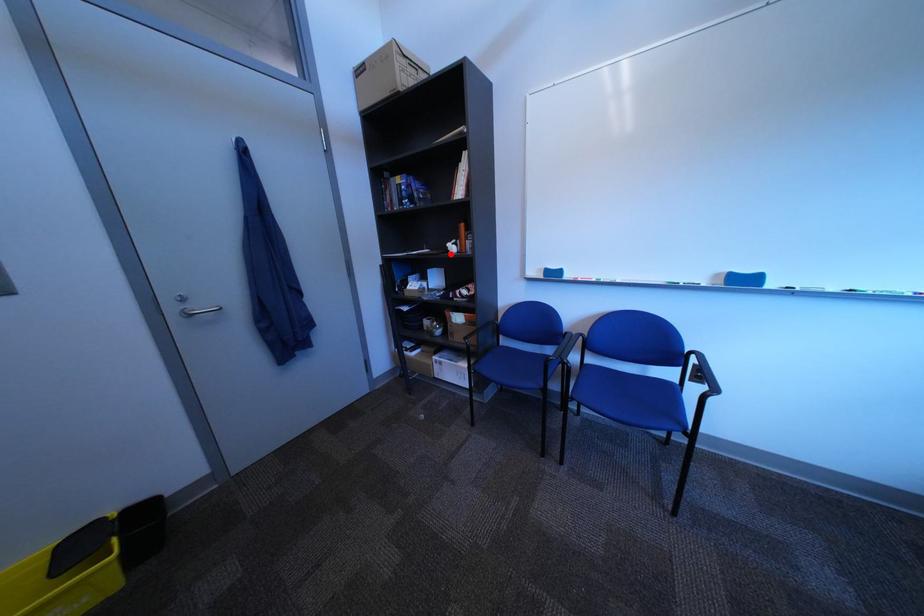
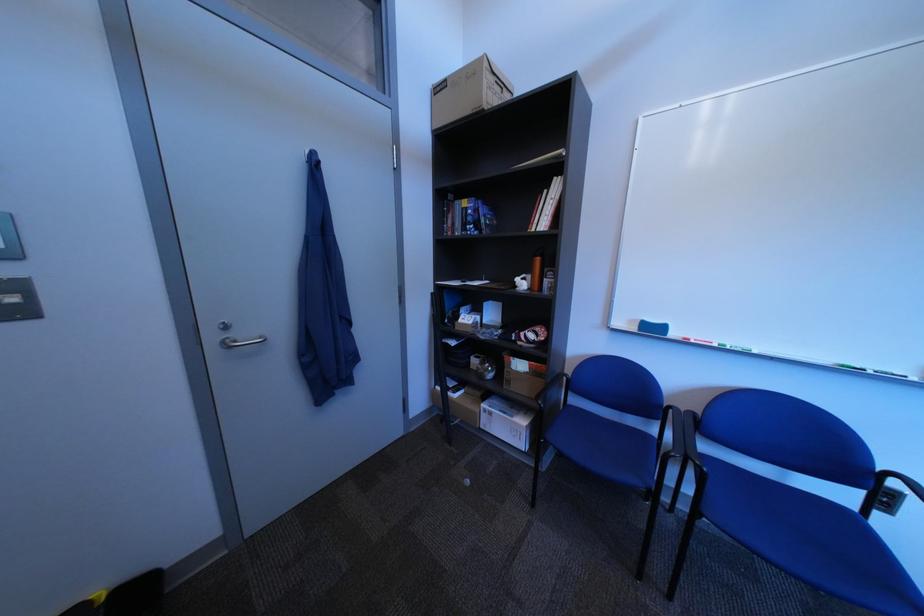
Question: A red point is marked in image1. In image2, is the corresponding 3D point closer to the camera or farther? Reply with the corresponding letter.

Choices:
 (A) The corresponding 3D point is closer.
 (B) The corresponding 3D point is farther.

Answer: (B)